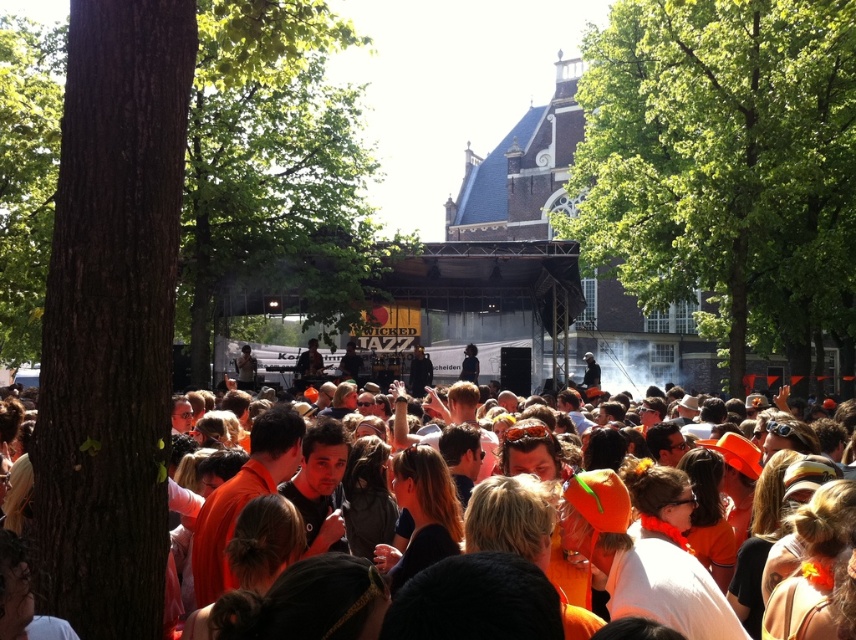
How much distance is there between green leafy tree at upper center and brown rough bark tree at left?

green leafy tree at upper center and brown rough bark tree at left are 53.31 meters apart from each other.

Between point (610, 179) and point (51, 592), which one is positioned in front?

Point (51, 592) is more forward.

Between point (752, 307) and point (45, 552), which one is positioned behind?

The point (752, 307) is more distant.

The height and width of the screenshot is (640, 856). In order to click on green leafy tree at upper center in this screenshot , I will do `click(724, 166)`.

Does green leafy tree at upper center have a larger size compared to green leafy tree at center?

No, green leafy tree at upper center is not bigger than green leafy tree at center.

Which is behind, point (806, 344) or point (227, 92)?

Point (227, 92)

Is point (628, 60) farther from camera compared to point (334, 252)?

No, (628, 60) is closer to viewer.

The width and height of the screenshot is (856, 640). In order to click on green leafy tree at upper center in this screenshot , I will do `click(724, 166)`.

Does brown rough bark tree at left lie in front of orange clothed crowd at center?

Yes, brown rough bark tree at left is in front of orange clothed crowd at center.

Can you confirm if brown rough bark tree at left is bigger than orange clothed crowd at center?

No, brown rough bark tree at left is not bigger than orange clothed crowd at center.

Which is behind, point (88, 500) or point (718, 444)?

Positioned behind is point (718, 444).

I want to click on brown rough bark tree at left, so tap(111, 317).